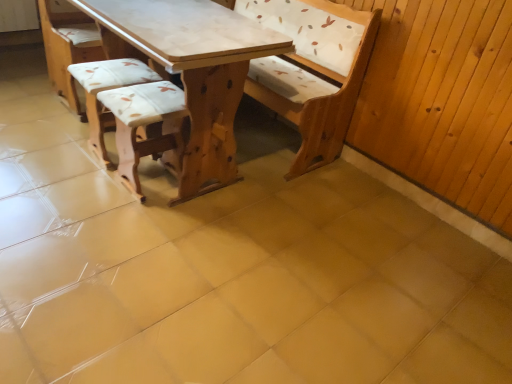
At what (x,y) coordinates should I click in order to perform the action: click on free space that is to the left of light brown wood table at center. Please return your answer as a coordinate pair (x, y). The image size is (512, 384). Looking at the image, I should click on (41, 139).